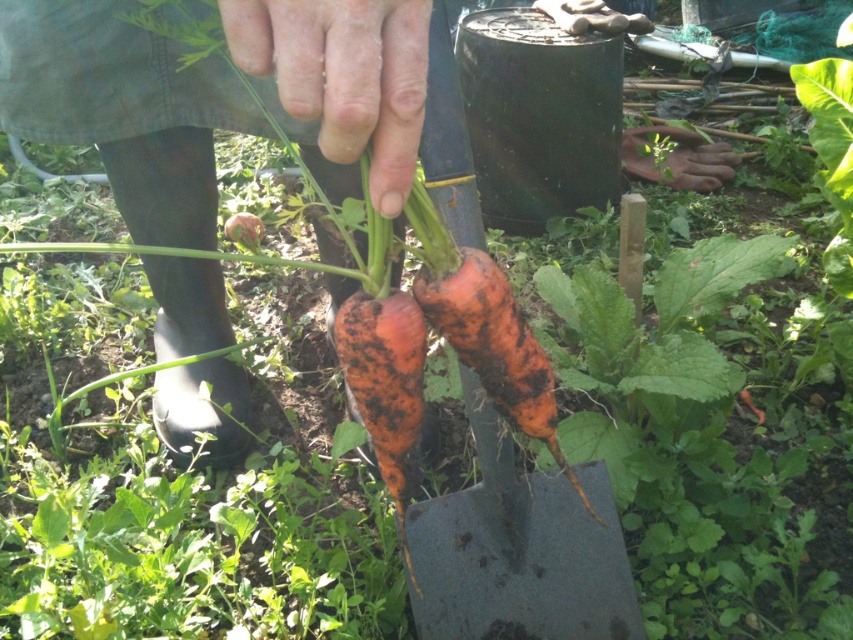
Question: Is dry skin at center further to the viewer compared to orange rough skin carrot at center?

Choices:
 (A) no
 (B) yes

Answer: (A)

Question: Does dry skin at center lie in front of orange rough carrot at center?

Choices:
 (A) yes
 (B) no

Answer: (A)

Question: Which of the following is the closest to the observer?

Choices:
 (A) dry skin at center
 (B) dull orange carrot at center
 (C) orange rough skin carrot at center
 (D) orange rough carrot at center

Answer: (A)

Question: Which of these objects is positioned closest to the orange rough skin carrot at center?

Choices:
 (A) dry skin at center
 (B) orange rough carrot at center
 (C) dull orange carrot at center

Answer: (C)

Question: Which object appears farthest from the camera in this image?

Choices:
 (A) dull orange carrot at center
 (B) orange rough carrot at center
 (C) dry skin at center

Answer: (B)

Question: Does orange rough skin carrot at center have a smaller size compared to orange rough carrot at center?

Choices:
 (A) yes
 (B) no

Answer: (B)